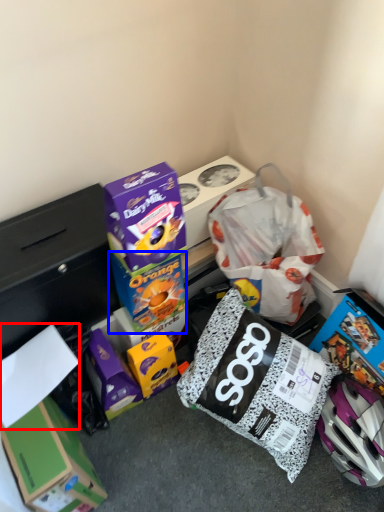
Question: Among these objects, which one is farthest to the camera, paper (highlighted by a red box) or box (highlighted by a blue box)?

Choices:
 (A) paper
 (B) box

Answer: (B)